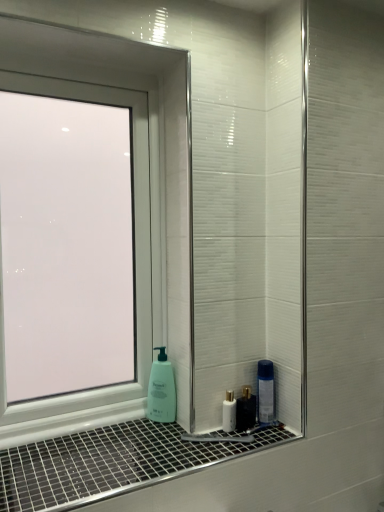
Question: Is point (155, 409) closer or farther from the camera than point (99, 481)?

Choices:
 (A) closer
 (B) farther

Answer: (B)

Question: Considering the relative positions of green matte soap dispenser at lower center and white glossy window sill at lower center in the image provided, is green matte soap dispenser at lower center to the left or to the right of white glossy window sill at lower center?

Choices:
 (A) right
 (B) left

Answer: (A)

Question: Considering the real-world distances, which object is closest to the transparent glass window at left?

Choices:
 (A) white glossy mouthwash at lower center
 (B) green matte soap dispenser at lower center
 (C) white glossy window sill at lower center

Answer: (B)

Question: Which is nearer to the transparent glass window at left?

Choices:
 (A) white glossy mouthwash at lower center
 (B) white glossy window sill at lower center
 (C) green matte soap dispenser at lower center

Answer: (C)